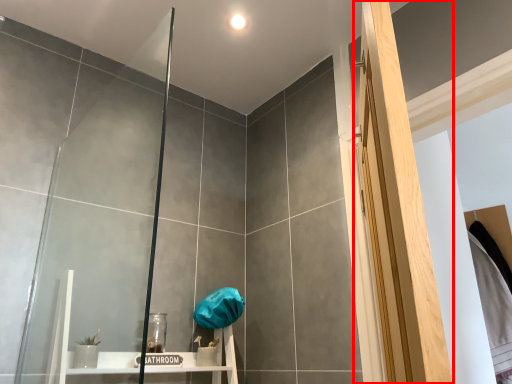
Question: From the image's perspective, where is screen door (annotated by the red box) located relative to glass door?

Choices:
 (A) below
 (B) above

Answer: (B)